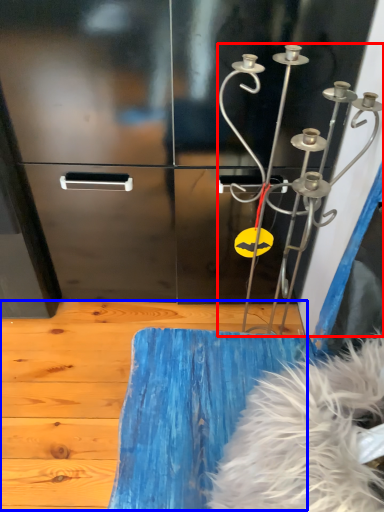
Question: Which point is closer to the camera, wind chime (highlighted by a red box) or plywood (highlighted by a blue box)?

Choices:
 (A) wind chime
 (B) plywood

Answer: (A)